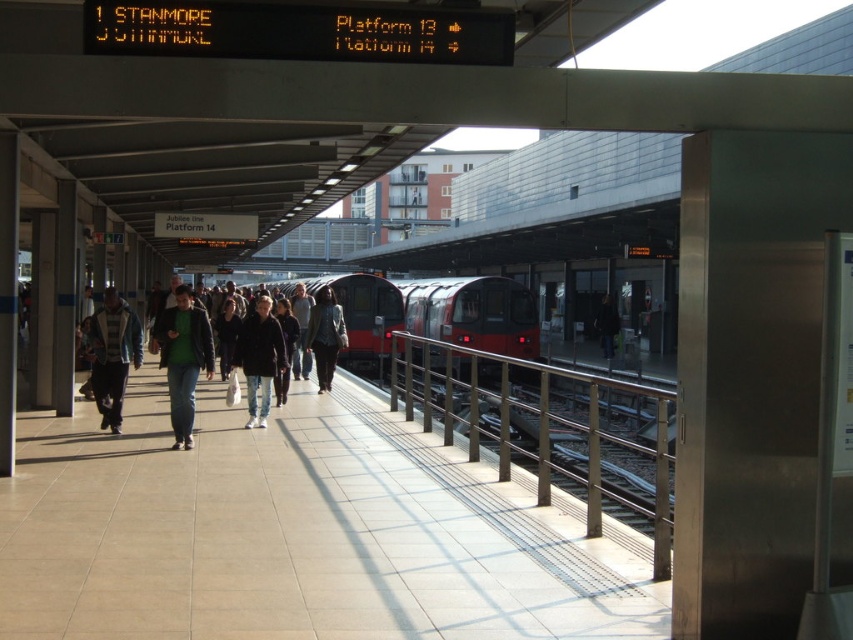
Does matte green shirt at center have a lesser height compared to matte black jacket at center?

Incorrect, matte green shirt at center's height does not fall short of matte black jacket at center's.

Is point (212, 362) farther from camera compared to point (328, 312)?

No, it is not.

Between point (160, 349) and point (328, 353), which one is positioned behind?

The point (328, 353) is behind.

The width and height of the screenshot is (853, 640). I want to click on matte green shirt at center, so pos(183,358).

Does point (97, 360) come behind point (340, 339)?

That is False.

The image size is (853, 640). What do you see at coordinates (113, 355) in the screenshot?
I see `light blue denim jacket at left` at bounding box center [113, 355].

Find the location of a particular element. light blue denim jacket at left is located at coordinates (113, 355).

Is smooth concrete platform at center closer to camera compared to red glossy train at center?

Yes, smooth concrete platform at center is closer to the viewer.

Is smooth concrete platform at center positioned at the back of red glossy train at center?

No, it is not.

Measure the distance between smooth concrete platform at center and camera.

They are 9.04 meters apart.

Image resolution: width=853 pixels, height=640 pixels. Find the location of `smooth concrete platform at center`. smooth concrete platform at center is located at coordinates (299, 532).